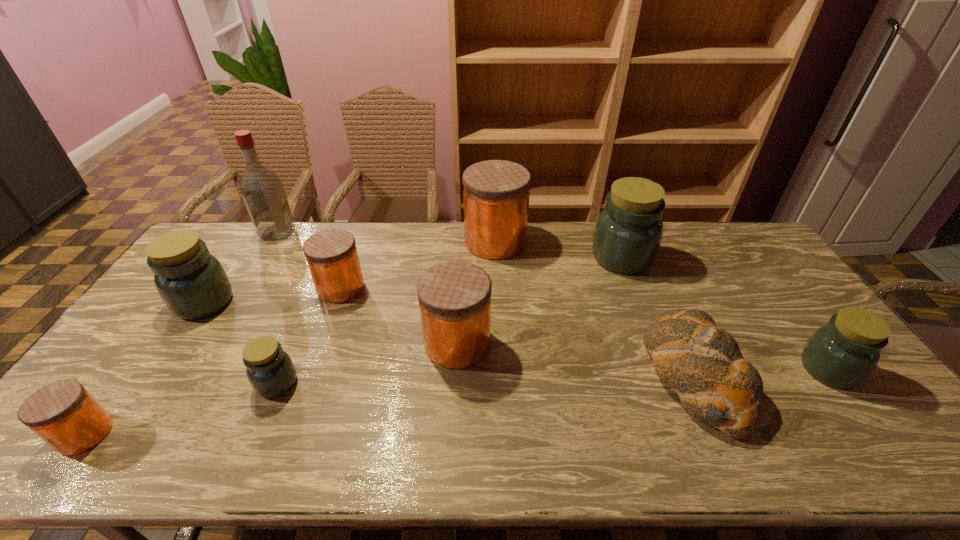
Where is `vacant space at the far edge of the desktop`? vacant space at the far edge of the desktop is located at coordinates (271, 246).

Identify the location of vacant space at the near edge of the desktop. The height and width of the screenshot is (540, 960). (826, 441).

I want to click on vacant space at the left edge of the desktop, so click(228, 265).

The width and height of the screenshot is (960, 540). In the image, there is a desktop. Identify the location of free space at the far right corner. (751, 247).

This screenshot has height=540, width=960. Identify the location of vacant space that's between the nearest jar and the leftmost green jar. (145, 368).

In order to click on unoccupied position between the farthest orange jar and the farthest green jar in this screenshot , I will do (559, 249).

This screenshot has width=960, height=540. I want to click on free space between the bread and the biggest green jar, so click(x=658, y=316).

You are a GUI agent. You are given a task and a screenshot of the screen. Output one action in this format:
    pyautogui.click(x=<x>, y=<y>)
    Task: Click on the blank region between the second green jar from left to right and the liquor
    The width and height of the screenshot is (960, 540).
    Given the screenshot: What is the action you would take?
    pyautogui.click(x=277, y=307)

Where is `empty location between the liquor and the second nearest orange jar`? This screenshot has height=540, width=960. empty location between the liquor and the second nearest orange jar is located at coordinates (368, 288).

Locate an element on the screen. free spot between the smallest orange jar and the second green jar from right to left is located at coordinates coord(353,346).